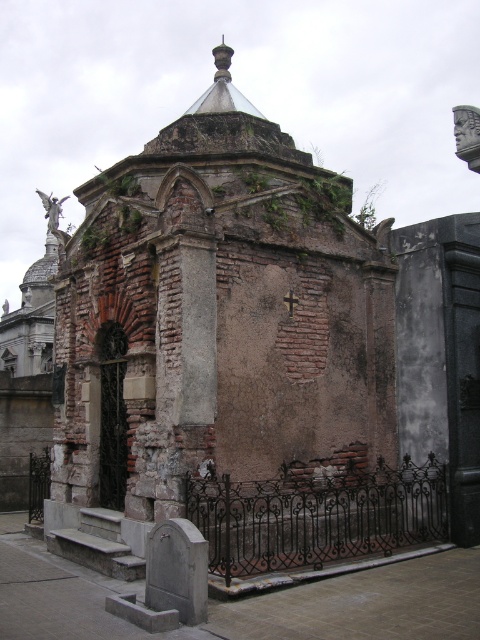
In the scene shown: You are a maintenance worker inspecting the cemetery. You need to replace the widest black wrought iron fence between the black wrought iron fence at lower center and the black wrought iron fence at lower left. Which one should you replace?

The black wrought iron fence at lower center should be replaced because its width surpasses that of the black wrought iron fence at lower left, making it the wider one.